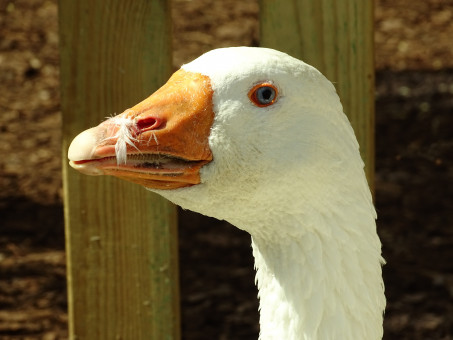
Image resolution: width=453 pixels, height=340 pixels. I want to click on wood board, so click(x=159, y=257), click(x=358, y=77).